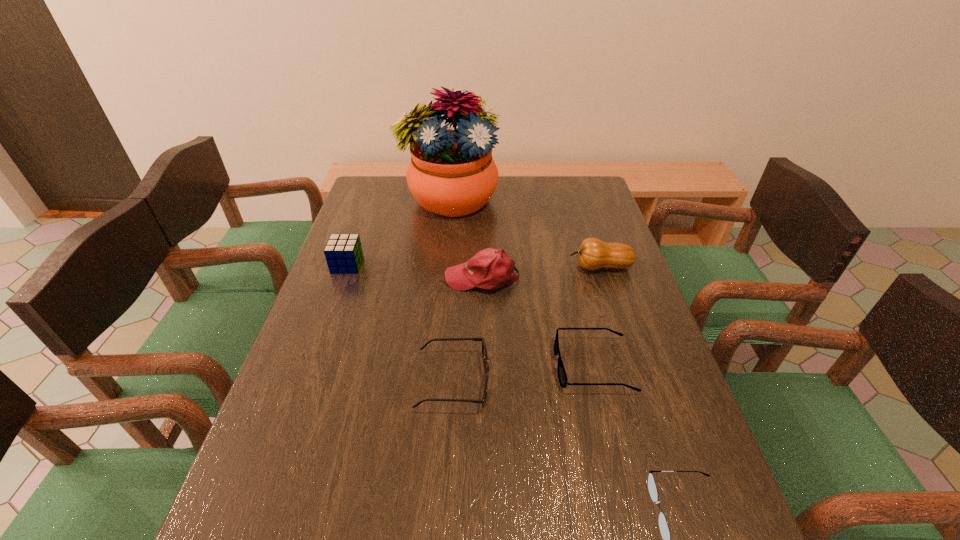
Locate an element on the screen. The image size is (960, 540). vacant point located between the gourd and the flower arrangement is located at coordinates (525, 233).

The image size is (960, 540). Identify the location of free spot between the leftmost spectacles and the leftmost object. (400, 323).

Where is `free space between the baseball cap and the gourd`? The width and height of the screenshot is (960, 540). free space between the baseball cap and the gourd is located at coordinates (541, 272).

Identify the location of object that can be found as the sixth closest to the gourd. (343, 252).

You are a GUI agent. You are given a task and a screenshot of the screen. Output one action in this format:
    pyautogui.click(x=<x>, y=<y>)
    Task: Click on the fifth closest object to the leftmost spectacles
    The width and height of the screenshot is (960, 540).
    Given the screenshot: What is the action you would take?
    pyautogui.click(x=593, y=254)

In order to click on spectacles that stands as the second closest to the flower arrangement in this screenshot , I will do `click(484, 349)`.

At what (x,y) coordinates should I click in order to perform the action: click on spectacles that is the closest to the gourd. Please return your answer as a coordinate pair (x, y). The width and height of the screenshot is (960, 540). Looking at the image, I should click on (562, 376).